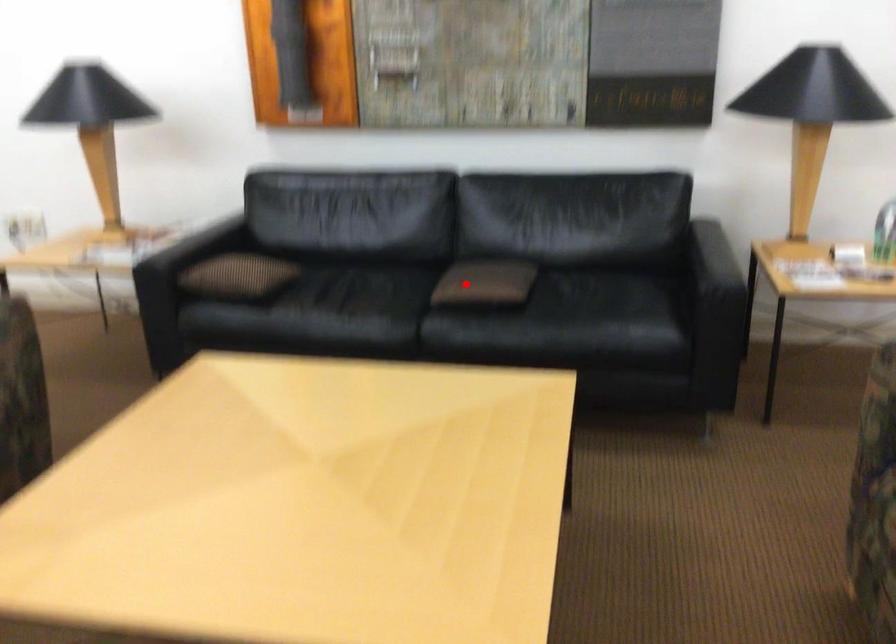
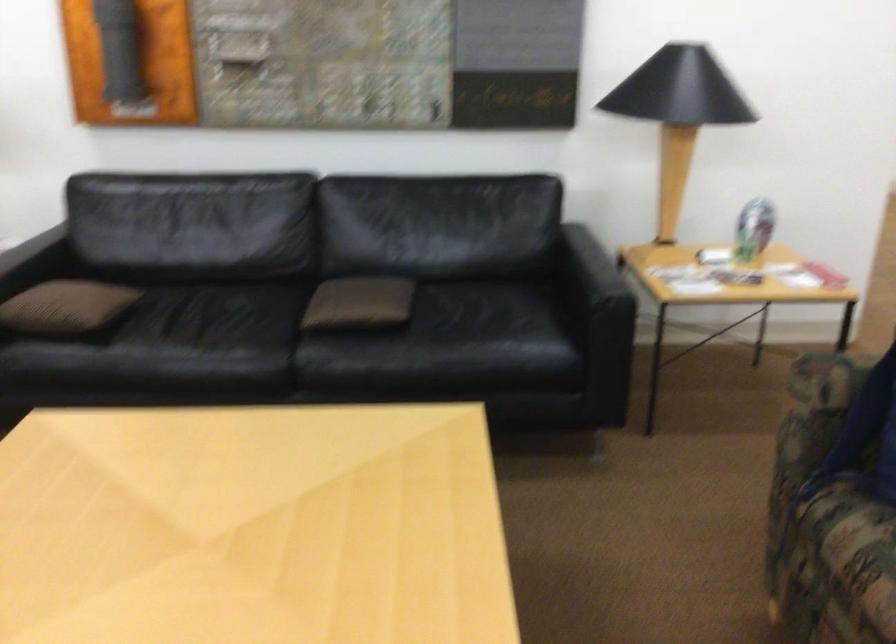
Locate, in the second image, the point that corresponds to the highlighted location in the first image.

(340, 304)